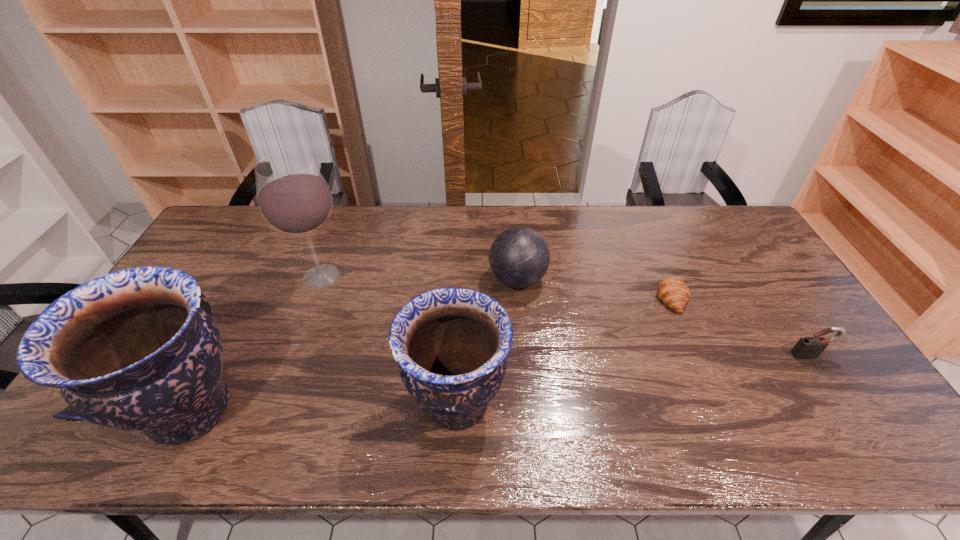
Locate an element on the screen. The height and width of the screenshot is (540, 960). free space between the fourth shortest object and the alcohol is located at coordinates (389, 340).

What are the coordinates of `blank region between the padlock and the tallest object` in the screenshot? It's located at (565, 316).

Select which object is the third closest to the third tallest object. Please provide its 2D coordinates. Your answer should be formatted as a tuple, i.e. [(x, y)], where the tuple contains the x and y coordinates of a point satisfying the conditions above.

[(136, 349)]

The image size is (960, 540). What are the coordinates of `object that is the fourth closest to the right pottery` in the screenshot? It's located at (672, 291).

Image resolution: width=960 pixels, height=540 pixels. What are the coordinates of `free location that satisfies the following two spatial constraints: 1. on the grip area of the second object from right to left; 2. on the right side of the bowling ball` in the screenshot? It's located at (518, 296).

The height and width of the screenshot is (540, 960). Identify the location of vacant region that satisfies the following two spatial constraints: 1. on the front side of the tallest object; 2. on the front handle of the left pottery. (273, 409).

Find the location of a particular element. This screenshot has width=960, height=540. free space that satisfies the following two spatial constraints: 1. on the front side of the second object from right to left; 2. on the right side of the tallest object is located at coordinates (314, 296).